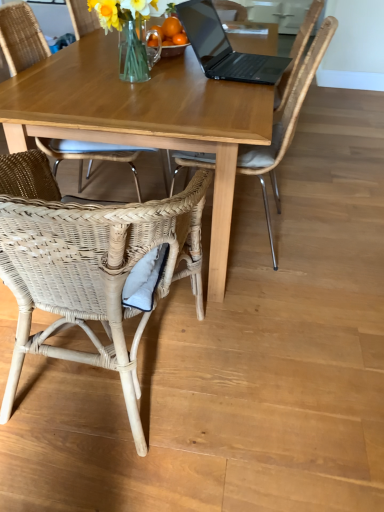
Question: Considering the relative sizes of woven wicker chair at lower left, the third chair positioned from the right, and wooden table at center in the image provided, is woven wicker chair at lower left, the third chair positioned from the right, wider than wooden table at center?

Choices:
 (A) yes
 (B) no

Answer: (B)

Question: Is wooden table at center a part of woven wicker chair at lower left, the first chair in the left-to-right sequence?

Choices:
 (A) yes
 (B) no

Answer: (B)

Question: Is woven wicker chair at lower left, the first chair in the left-to-right sequence, in front of wooden table at center?

Choices:
 (A) no
 (B) yes

Answer: (A)

Question: From the image's perspective, is woven wicker chair at lower left, the first chair in the left-to-right sequence, located above wooden table at center?

Choices:
 (A) no
 (B) yes

Answer: (B)

Question: Does woven wicker chair at lower left, the first chair in the left-to-right sequence, have a smaller size compared to wooden table at center?

Choices:
 (A) yes
 (B) no

Answer: (A)

Question: Could you tell me if woven wicker chair at lower left, the third chair positioned from the right, is turned towards wooden table at center?

Choices:
 (A) no
 (B) yes

Answer: (B)

Question: Is wooden table at center facing towards black matte laptop at upper center?

Choices:
 (A) no
 (B) yes

Answer: (A)

Question: Is the position of wooden table at center less distant than that of black matte laptop at upper center?

Choices:
 (A) yes
 (B) no

Answer: (A)

Question: From a real-world perspective, is wooden table at center positioned under black matte laptop at upper center based on gravity?

Choices:
 (A) yes
 (B) no

Answer: (A)

Question: From the image's perspective, would you say wooden table at center is shown under black matte laptop at upper center?

Choices:
 (A) yes
 (B) no

Answer: (A)

Question: Is wooden table at center positioned behind black matte laptop at upper center?

Choices:
 (A) no
 (B) yes

Answer: (A)

Question: Is wooden table at center turned away from black matte laptop at upper center?

Choices:
 (A) no
 (B) yes

Answer: (A)

Question: Is woven wicker chair at lower left, the first chair in the left-to-right sequence, facing towards black matte laptop at upper center?

Choices:
 (A) no
 (B) yes

Answer: (B)